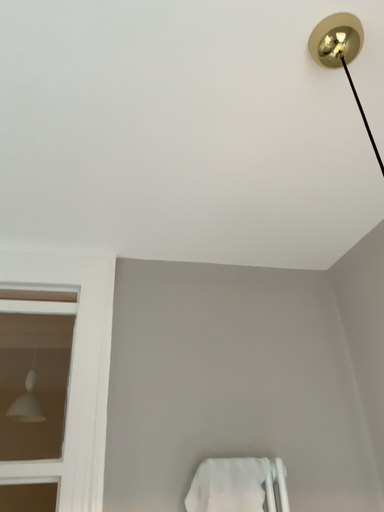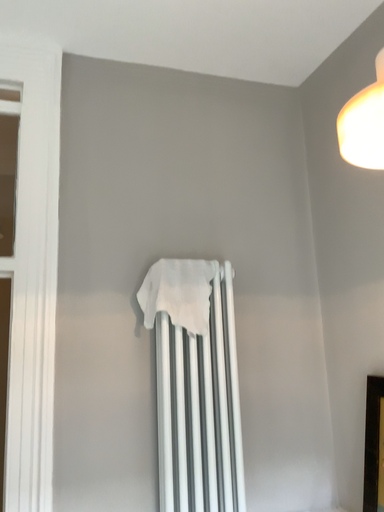
Question: Which way did the camera rotate in the video?

Choices:
 (A) rotated upward
 (B) rotated downward

Answer: (B)